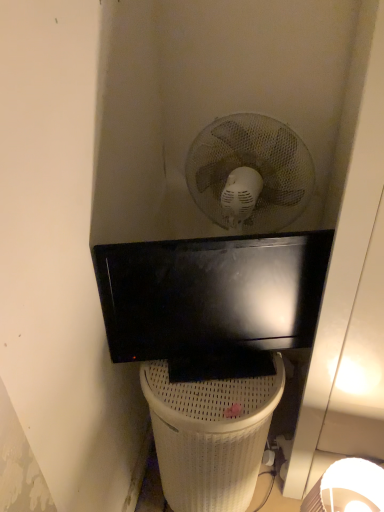
Question: Is white woven trash bin/can at lower center smaller than black glossy television at center?

Choices:
 (A) yes
 (B) no

Answer: (B)

Question: Does white woven trash bin/can at lower center have a larger size compared to black glossy television at center?

Choices:
 (A) no
 (B) yes

Answer: (B)

Question: From a real-world perspective, is white woven trash bin/can at lower center under black glossy television at center?

Choices:
 (A) no
 (B) yes

Answer: (B)

Question: Is white woven trash bin/can at lower center further to the viewer compared to black glossy television at center?

Choices:
 (A) yes
 (B) no

Answer: (A)

Question: Can you confirm if white woven trash bin/can at lower center is shorter than black glossy television at center?

Choices:
 (A) yes
 (B) no

Answer: (B)

Question: Is white woven trash bin/can at lower center looking in the opposite direction of black glossy television at center?

Choices:
 (A) no
 (B) yes

Answer: (A)

Question: Is black glossy television at center positioned far away from white woven trash bin/can at lower center?

Choices:
 (A) yes
 (B) no

Answer: (B)

Question: Considering the relative sizes of black glossy television at center and white woven trash bin/can at lower center in the image provided, is black glossy television at center bigger than white woven trash bin/can at lower center?

Choices:
 (A) yes
 (B) no

Answer: (B)

Question: Is the position of black glossy television at center more distant than that of white woven trash bin/can at lower center?

Choices:
 (A) yes
 (B) no

Answer: (B)

Question: From the image's perspective, is black glossy television at center below white woven trash bin/can at lower center?

Choices:
 (A) no
 (B) yes

Answer: (A)

Question: Can you confirm if black glossy television at center is positioned to the left of white woven trash bin/can at lower center?

Choices:
 (A) yes
 (B) no

Answer: (B)

Question: Considering the relative sizes of black glossy television at center and white woven trash bin/can at lower center in the image provided, is black glossy television at center thinner than white woven trash bin/can at lower center?

Choices:
 (A) no
 (B) yes

Answer: (B)

Question: From a real-world perspective, is white woven trash bin/can at lower center above or below black glossy television at center?

Choices:
 (A) above
 (B) below

Answer: (B)